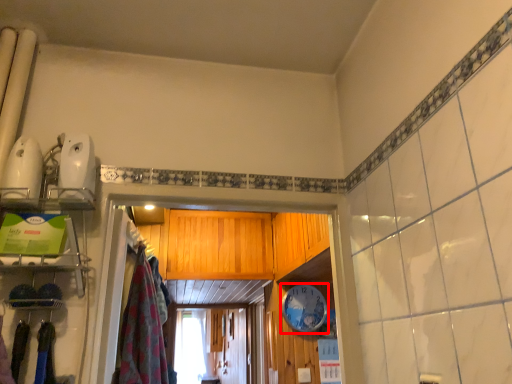
Question: From the image's perspective, what is the correct spatial relationship of clock (annotated by the red box) in relation to clothing?

Choices:
 (A) below
 (B) above

Answer: (A)